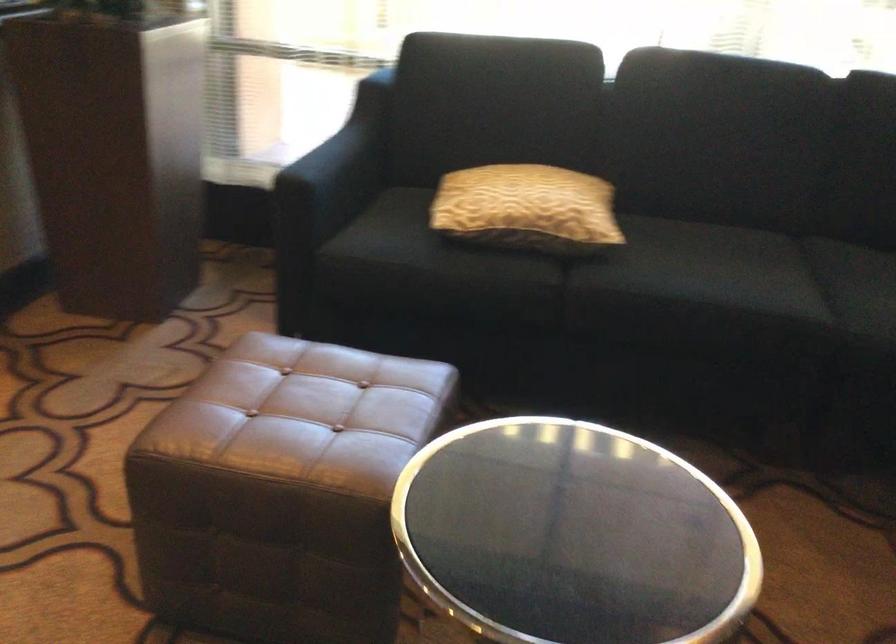
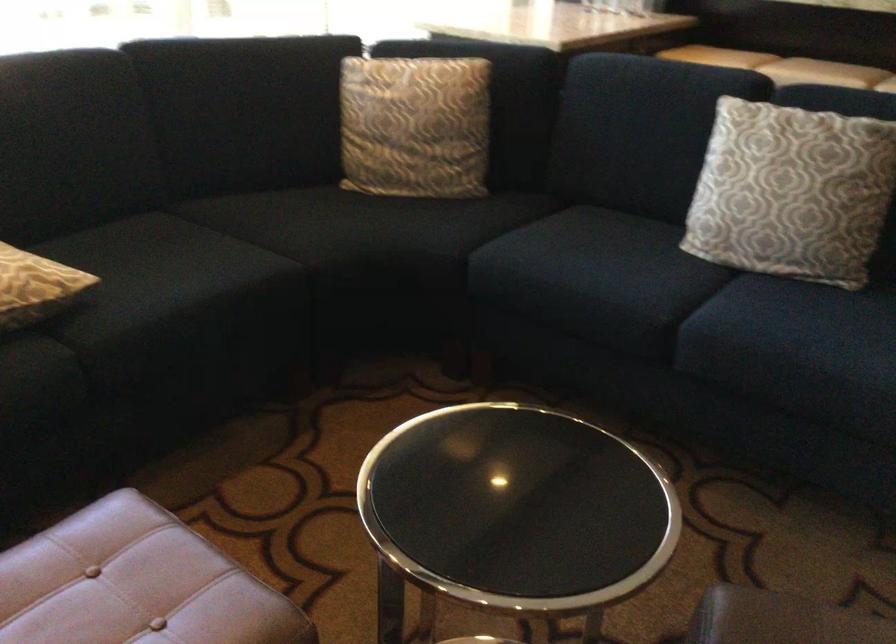
Question: I am providing you with two images of the same scene from different viewpoints. Please identify which objects are invisible in image2.

Choices:
 (A) chair sitting surface
 (B) sofa sitting surface
 (C) patterned pillow
 (D) none of these

Answer: (D)